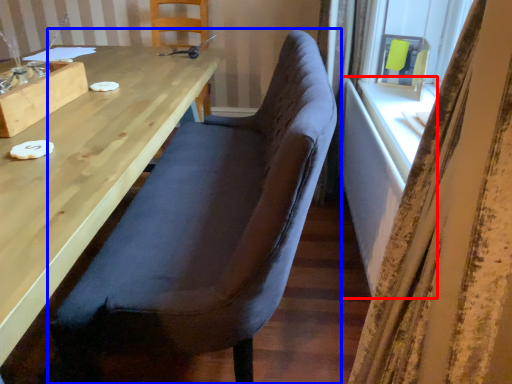
Question: Among these objects, which one is farthest to the camera, table (highlighted by a red box) or chair (highlighted by a blue box)?

Choices:
 (A) table
 (B) chair

Answer: (A)